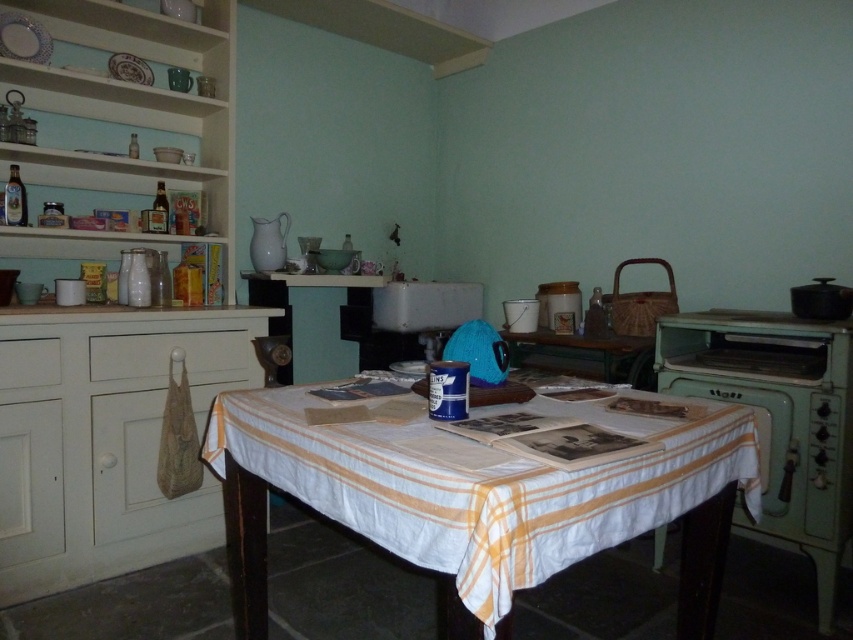
Question: Can you confirm if wooden table at center is positioned below white wood drawer at left?

Choices:
 (A) yes
 (B) no

Answer: (A)

Question: Which object is positioned closest to the white wood drawer at left?

Choices:
 (A) white striped fabric at center
 (B) wooden table at center
 (C) white glossy shelves at upper left
 (D) white wood drawer at lower left

Answer: (D)

Question: Does white striped fabric at center have a lesser width compared to green matte oven at right?

Choices:
 (A) yes
 (B) no

Answer: (B)

Question: Observing the image, what is the correct spatial positioning of white wood drawer at lower left in reference to wooden table at center?

Choices:
 (A) below
 (B) above

Answer: (A)

Question: Among these objects, which one is farthest from the camera?

Choices:
 (A) white wood drawer at lower left
 (B) white striped fabric at center
 (C) white wood drawer at left

Answer: (A)

Question: Which point is closer to the camera?

Choices:
 (A) [374, 522]
 (B) [183, 132]

Answer: (A)